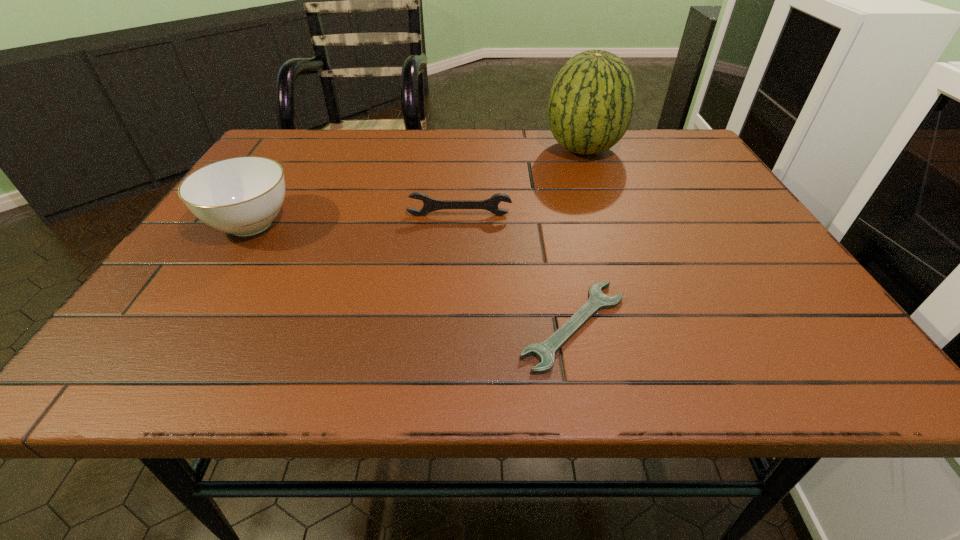
The image size is (960, 540). What are the coordinates of `free space at the far right corner of the desktop` in the screenshot? It's located at (664, 131).

I want to click on free space between the nearer wrench and the taller wrench, so click(x=516, y=271).

Where is `blank region between the chinaware and the farthest object`? blank region between the chinaware and the farthest object is located at coordinates (417, 186).

Find the location of a particular element. This screenshot has height=540, width=960. blank region between the farthest object and the nearer wrench is located at coordinates (579, 238).

Locate an element on the screen. vacant area that lies between the farther wrench and the shorter wrench is located at coordinates (516, 271).

I want to click on free space between the farthest object and the nearer wrench, so click(x=579, y=238).

I want to click on unoccupied area between the tallest object and the farther wrench, so 521,182.

Locate an element on the screen. This screenshot has width=960, height=540. unoccupied area between the nearest object and the watermelon is located at coordinates (579, 238).

Identify the location of vacant area that lies between the nearest object and the third tallest object. The image size is (960, 540). (516, 271).

Find the location of a particular element. The width and height of the screenshot is (960, 540). vacant region between the tallest object and the nearer wrench is located at coordinates (579, 238).